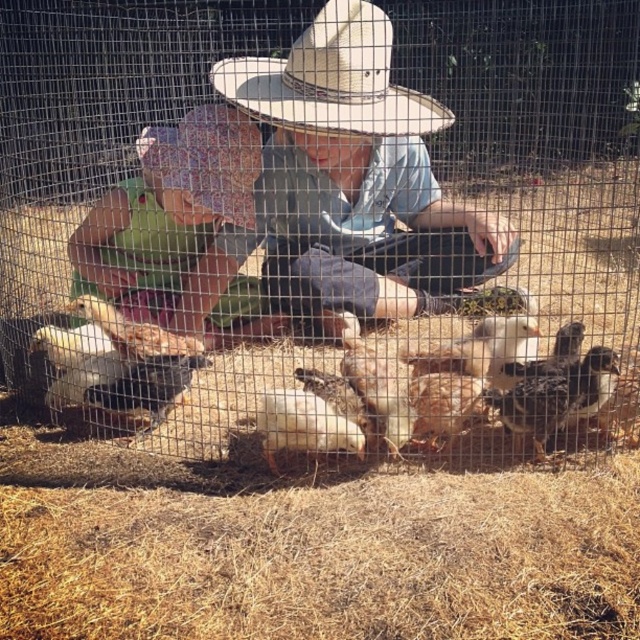
Measure the distance from light brown straw hat at center to white feathered chicken at center.

light brown straw hat at center is 1.04 meters from white feathered chicken at center.

Who is positioned more to the left, light brown straw hat at center or white feathered chicken at center?

From the viewer's perspective, white feathered chicken at center appears more on the left side.

Where is `light brown straw hat at center`? light brown straw hat at center is located at coordinates (358, 172).

Between light brown straw hat at center and beige straw cowboy hat at center, which one appears on the right side from the viewer's perspective?

Positioned to the right is light brown straw hat at center.

Can you confirm if light brown straw hat at center is positioned to the left of beige straw cowboy hat at center?

In fact, light brown straw hat at center is to the right of beige straw cowboy hat at center.

At what (x,y) coordinates should I click in order to perform the action: click on light brown straw hat at center. Please return your answer as a coordinate pair (x, y). Looking at the image, I should click on (358, 172).

How much distance is there between beige straw cowboy hat at center and white fluffy chicken at center?

beige straw cowboy hat at center and white fluffy chicken at center are 31.02 inches apart from each other.

Does beige straw cowboy hat at center have a lesser width compared to white fluffy chicken at center?

Yes.

Describe the element at coordinates (332, 81) in the screenshot. I see `beige straw cowboy hat at center` at that location.

Locate an element on the screen. This screenshot has height=640, width=640. beige straw cowboy hat at center is located at coordinates (332, 81).